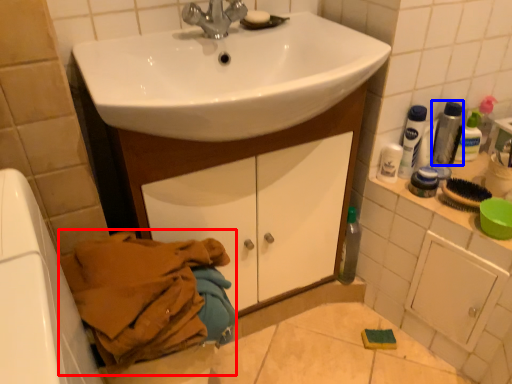
Question: Among these objects, which one is nearest to the camera, laundry (highlighted by a red box) or mouthwash (highlighted by a blue box)?

Choices:
 (A) laundry
 (B) mouthwash

Answer: (A)